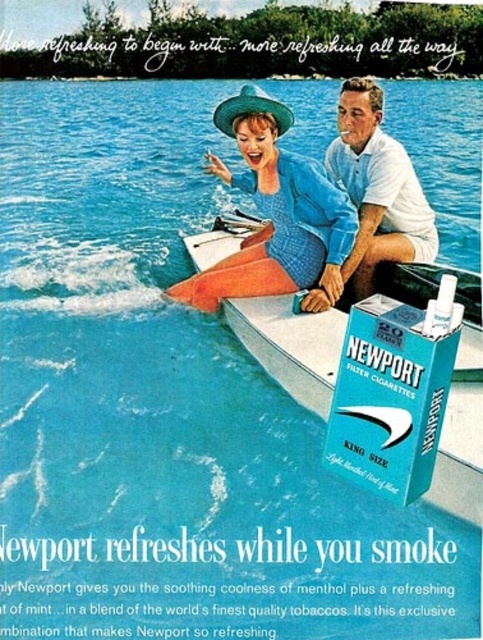
Based on the photo, who is positioned more to the right, blue textured dress at center or white plastic boat at center?

From the viewer's perspective, white plastic boat at center appears more on the right side.

Is point (279, 166) closer to camera compared to point (457, 420)?

That is False.

Is point (334, 268) closer to camera compared to point (480, 449)?

No, (334, 268) is behind (480, 449).

The image size is (483, 640). I want to click on blue textured dress at center, so click(274, 212).

Is blue textured dress at center bigger than white cotton shirt at center?

Yes, blue textured dress at center is bigger than white cotton shirt at center.

Is blue textured dress at center further to the viewer compared to white cotton shirt at center?

No, it is in front of white cotton shirt at center.

Is point (325, 196) positioned in front of point (392, 163)?

Yes, it is.

The image size is (483, 640). What are the coordinates of `blue textured dress at center` in the screenshot? It's located at (274, 212).

Does white plastic boat at center have a smaller size compared to white cotton shirt at center?

Indeed, white plastic boat at center has a smaller size compared to white cotton shirt at center.

Is white plastic boat at center taller than white cotton shirt at center?

In fact, white plastic boat at center may be shorter than white cotton shirt at center.

Which is in front, point (309, 352) or point (342, 177)?

Point (309, 352)

Identify the location of white plastic boat at center. (290, 346).